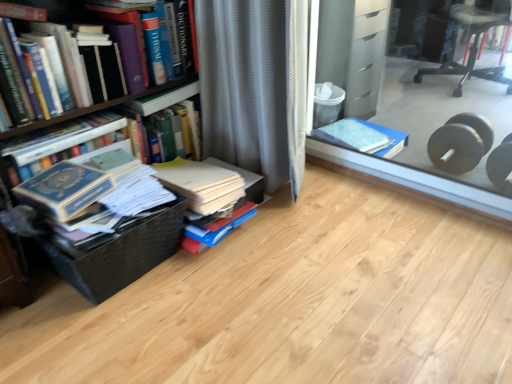
Question: Considering the relative sizes of gray textured curtain at center and hardcover book at left, arranged as the 1th book when viewed from the left, in the image provided, is gray textured curtain at center wider than hardcover book at left, arranged as the 1th book when viewed from the left,?

Choices:
 (A) yes
 (B) no

Answer: (A)

Question: Is the position of gray textured curtain at center more distant than that of hardcover book at left, the 4th book from the right?

Choices:
 (A) no
 (B) yes

Answer: (B)

Question: Is hardcover book at left, arranged as the 1th book when viewed from the left, at the back of gray textured curtain at center?

Choices:
 (A) yes
 (B) no

Answer: (B)

Question: Considering the relative sizes of gray textured curtain at center and hardcover book at left, the 4th book from the right, in the image provided, is gray textured curtain at center bigger than hardcover book at left, the 4th book from the right,?

Choices:
 (A) yes
 (B) no

Answer: (A)

Question: From the image's perspective, is gray textured curtain at center over hardcover book at left, the 4th book from the right?

Choices:
 (A) yes
 (B) no

Answer: (A)

Question: From a real-world perspective, relative to hardcover book at left, arranged as the 2th book when viewed from the left, is blue cardboard box at center vertically above or below?

Choices:
 (A) above
 (B) below

Answer: (B)

Question: Is point (450, 69) positioned closer to the camera than point (116, 1)?

Choices:
 (A) farther
 (B) closer

Answer: (A)

Question: In terms of width, does blue cardboard box at center look wider or thinner when compared to hardcover book at left, the third book viewed from the right?

Choices:
 (A) wide
 (B) thin

Answer: (A)

Question: In terms of size, does blue cardboard box at center appear bigger or smaller than hardcover book at left, arranged as the 2th book when viewed from the left?

Choices:
 (A) big
 (B) small

Answer: (A)

Question: From the image's perspective, is hardcover book at left, the third book viewed from the right, above or below blue cardboard box at center?

Choices:
 (A) above
 (B) below

Answer: (B)

Question: Considering the positions of hardcover book at left, the third book viewed from the right, and blue cardboard box at center in the image, is hardcover book at left, the third book viewed from the right, wider or thinner than blue cardboard box at center?

Choices:
 (A) wide
 (B) thin

Answer: (B)

Question: In terms of height, does hardcover book at left, the third book viewed from the right, look taller or shorter compared to blue cardboard box at center?

Choices:
 (A) tall
 (B) short

Answer: (A)

Question: Is hardcover book at left, the third book viewed from the right, situated inside blue cardboard box at center or outside?

Choices:
 (A) outside
 (B) inside

Answer: (A)

Question: Relative to gray textured curtain at center, is blue cardboard box at center in front or behind?

Choices:
 (A) behind
 (B) front

Answer: (A)

Question: Is blue cardboard box at center inside or outside of gray textured curtain at center?

Choices:
 (A) outside
 (B) inside

Answer: (A)